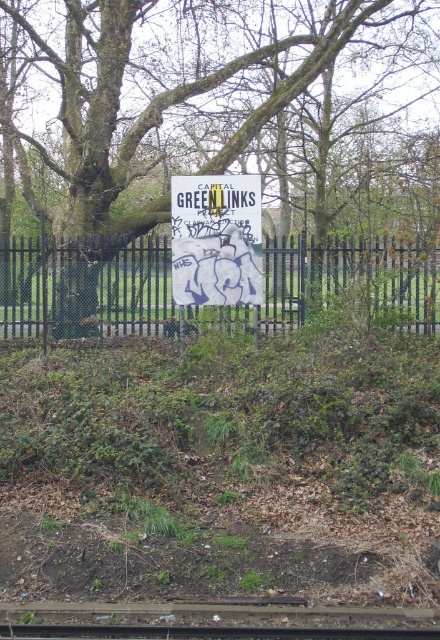
You are a gardener planning to trim the green rough bark tree at center and the black metal fence at center. Which object requires more attention due to its size?

The green rough bark tree at center requires more attention because it has a larger size compared to the black metal fence at center.

Consider the image. You are standing in front of the signboard and want to touch both the green rough bark tree at center and the black metal fence at center. Which one would you reach first?

You would reach the green rough bark tree at center first because it is closer to you than the black metal fence at center.